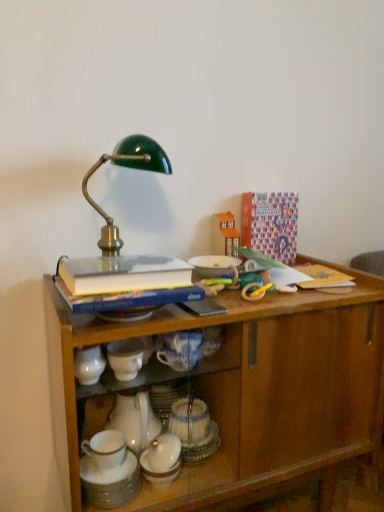
Question: Which direction should I rotate to look at wooden toy house at upper center, which appears as the second toy when ordered from the bottom, — up or down?

Choices:
 (A) down
 (B) up

Answer: (B)

Question: Considering the relative sizes of white glossy cup at lower center and rubber yellow and blue teething ring at upper right, placed as the 1th toy when sorted from bottom to top, in the image provided, is white glossy cup at lower center bigger than rubber yellow and blue teething ring at upper right, placed as the 1th toy when sorted from bottom to top,?

Choices:
 (A) yes
 (B) no

Answer: (A)

Question: Can you confirm if white glossy cup at lower center is wider than rubber yellow and blue teething ring at upper right, placed as the 1th toy when sorted from bottom to top?

Choices:
 (A) no
 (B) yes

Answer: (B)

Question: From a real-world perspective, is white glossy cup at lower center located higher than rubber yellow and blue teething ring at upper right, placed as the 1th toy when sorted from bottom to top?

Choices:
 (A) yes
 (B) no

Answer: (B)

Question: From a real-world perspective, is white glossy cup at lower center physically below rubber yellow and blue teething ring at upper right, which appears as the first toy when viewed from the front?

Choices:
 (A) no
 (B) yes

Answer: (B)

Question: Is white glossy cup at lower center in front of rubber yellow and blue teething ring at upper right, placed as the 1th toy when sorted from bottom to top?

Choices:
 (A) no
 (B) yes

Answer: (B)

Question: Is white glossy cup at lower center positioned beyond the bounds of rubber yellow and blue teething ring at upper right, the second toy from the back?

Choices:
 (A) no
 (B) yes

Answer: (B)

Question: Does wooden toy house at upper center, which appears as the second toy when ordered from the bottom, lie in front of white glossy cup at lower center?

Choices:
 (A) yes
 (B) no

Answer: (B)

Question: Can you confirm if wooden toy house at upper center, arranged as the 1th toy when viewed from the top, is taller than white glossy cup at lower center?

Choices:
 (A) no
 (B) yes

Answer: (B)

Question: Is wooden toy house at upper center, arranged as the 1th toy when viewed from the top, aimed at white glossy cup at lower center?

Choices:
 (A) yes
 (B) no

Answer: (B)

Question: Is white glossy cup at lower center at the back of wooden toy house at upper center, which appears as the second toy when ordered from the bottom?

Choices:
 (A) yes
 (B) no

Answer: (B)

Question: Considering the relative sizes of wooden toy house at upper center, arranged as the 1th toy when viewed from the top, and white glossy cup at lower center in the image provided, is wooden toy house at upper center, arranged as the 1th toy when viewed from the top, thinner than white glossy cup at lower center?

Choices:
 (A) no
 (B) yes

Answer: (B)

Question: Is wooden toy house at upper center, marked as the second toy in a front-to-back arrangement, in contact with white glossy cup at lower center?

Choices:
 (A) yes
 (B) no

Answer: (B)

Question: Does wooden toy house at upper center, the 1th toy viewed from the back, turn towards wooden cabinet at center?

Choices:
 (A) yes
 (B) no

Answer: (B)